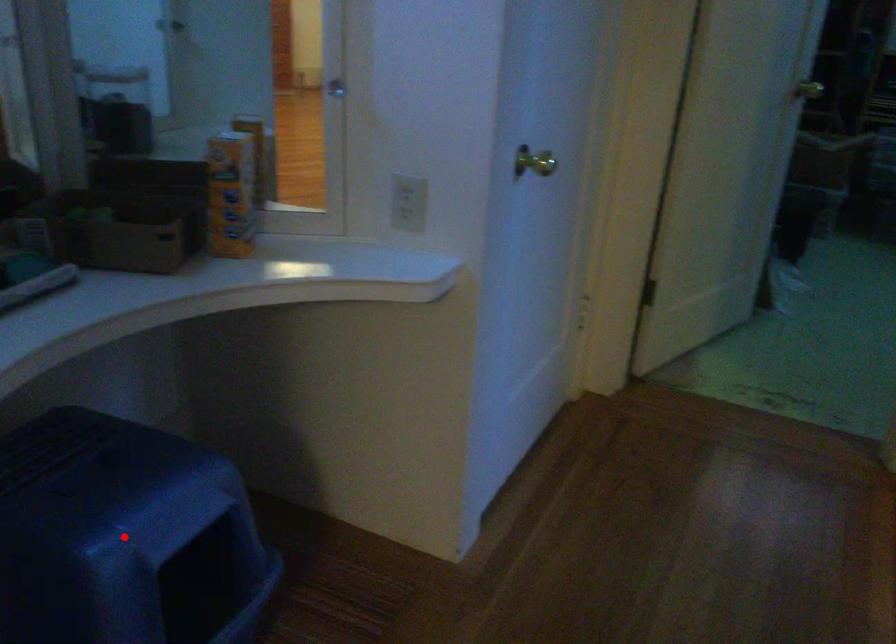
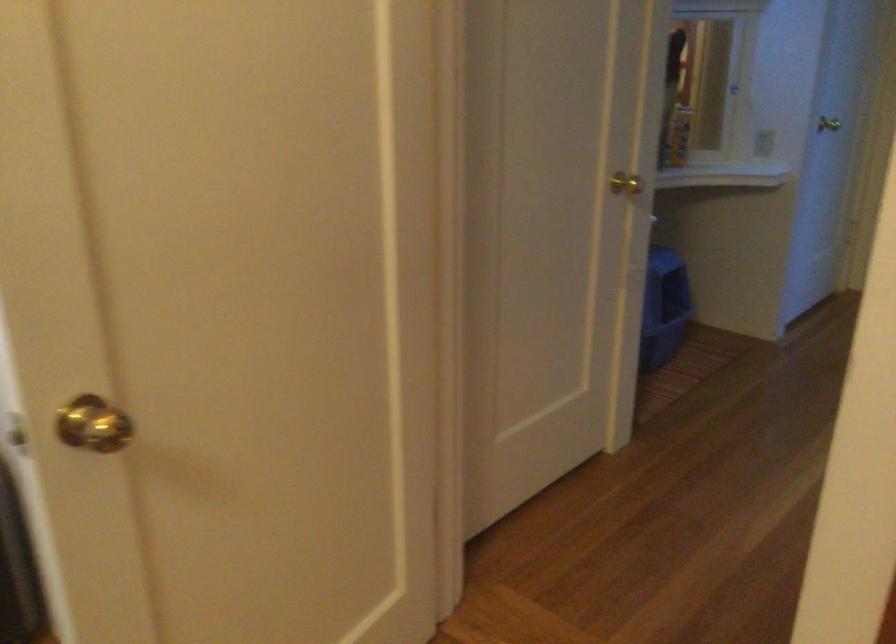
Question: I am providing you with two images of the same scene from different viewpoints. A red point is marked on the first image. At the location where the point appears in image 1, is it still visible in image 2?

Choices:
 (A) Yes
 (B) No

Answer: (B)